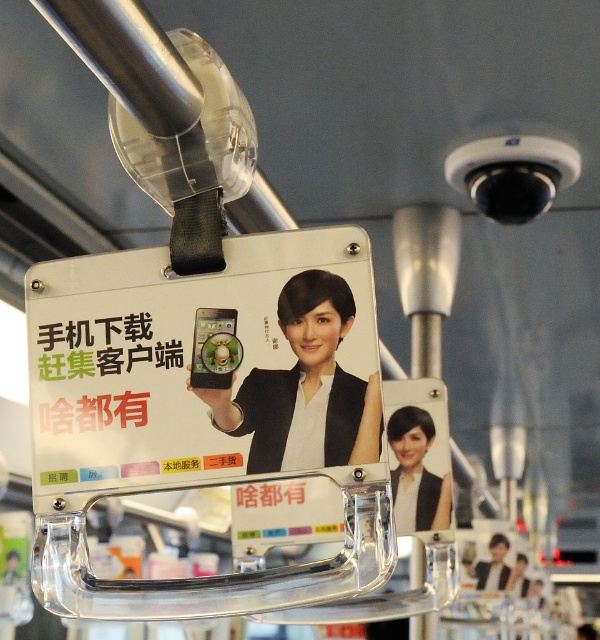
How far apart are matte black phone at center and matte black jacket at center?

They are 32.37 centimeters apart.

Can you confirm if matte black phone at center is thinner than matte black jacket at center?

In fact, matte black phone at center might be wider than matte black jacket at center.

Is point (271, 396) closer to viewer compared to point (397, 468)?

Yes, it is.

This screenshot has height=640, width=600. In order to click on matte black phone at center in this screenshot , I will do `click(304, 388)`.